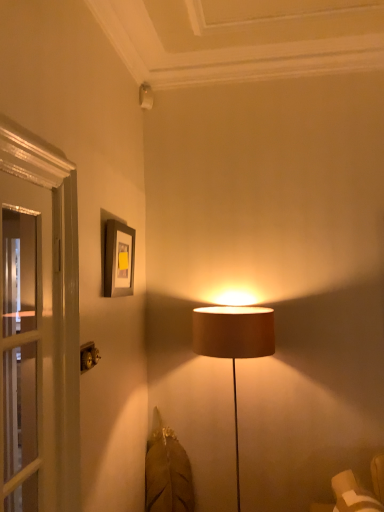
Where is `matte gray picture frame at upper left`? This screenshot has width=384, height=512. matte gray picture frame at upper left is located at coordinates click(x=118, y=259).

Describe the element at coordinates (118, 259) in the screenshot. This screenshot has height=512, width=384. I see `matte gray picture frame at upper left` at that location.

Looking at this image, measure the distance between matte gray picture frame at upper left and camera.

The depth of matte gray picture frame at upper left is 5.60 feet.

What do you see at coordinates (88, 356) in the screenshot? I see `metallic gold at lower left` at bounding box center [88, 356].

Measure the distance between point (85, 356) and camera.

Point (85, 356) and camera are 1.51 meters apart from each other.

Image resolution: width=384 pixels, height=512 pixels. I want to click on metallic gold at lower left, so click(x=88, y=356).

Where is `matte gray picture frame at upper left`? The height and width of the screenshot is (512, 384). matte gray picture frame at upper left is located at coordinates (118, 259).

Considering the positions of objects matte gray picture frame at upper left and metallic gold at lower left in the image provided, who is more to the left, matte gray picture frame at upper left or metallic gold at lower left?

From the viewer's perspective, metallic gold at lower left appears more on the left side.

Does matte gray picture frame at upper left come behind metallic gold at lower left?

Yes, matte gray picture frame at upper left is further from the camera.

Which is farther from the camera, (110, 269) or (90, 351)?

Positioned behind is point (110, 269).

From the image's perspective, who appears lower, matte gray picture frame at upper left or metallic gold at lower left?

metallic gold at lower left.

From a real-world perspective, which object stands above the other?

From a 3D spatial view, matte gray picture frame at upper left is above.

Can you confirm if matte gray picture frame at upper left is wider than metallic gold at lower left?

Indeed, matte gray picture frame at upper left has a greater width compared to metallic gold at lower left.

Is matte gray picture frame at upper left taller than metallic gold at lower left?

Correct, matte gray picture frame at upper left is much taller as metallic gold at lower left.

Who is bigger, matte gray picture frame at upper left or metallic gold at lower left?

Bigger between the two is matte gray picture frame at upper left.

Can we say matte gray picture frame at upper left lies outside metallic gold at lower left?

matte gray picture frame at upper left is positioned outside metallic gold at lower left.

Consider the image. Is the surface of matte gray picture frame at upper left in direct contact with metallic gold at lower left?

No, matte gray picture frame at upper left is not touching metallic gold at lower left.

Does matte gray picture frame at upper left turn towards metallic gold at lower left?

No, matte gray picture frame at upper left is not oriented towards metallic gold at lower left.

This screenshot has height=512, width=384. Identify the location of picture frame that appears behind the metallic gold at lower left. (118, 259).

Which object is positioned more to the left, metallic gold at lower left or matte gray picture frame at upper left?

metallic gold at lower left.

Which is behind, metallic gold at lower left or matte gray picture frame at upper left?

matte gray picture frame at upper left is further away from the camera.

Does point (90, 354) appear closer or farther from the camera than point (122, 252)?

Clearly, point (90, 354) is closer to the camera than point (122, 252).

From the image's perspective, between metallic gold at lower left and matte gray picture frame at upper left, which one is located above?

matte gray picture frame at upper left is shown above in the image.

From a real-world perspective, which object stands above the other?

matte gray picture frame at upper left is physically above.

Considering the relative sizes of metallic gold at lower left and matte gray picture frame at upper left in the image provided, is metallic gold at lower left wider than matte gray picture frame at upper left?

No.

Based on the photo, between metallic gold at lower left and matte gray picture frame at upper left, which one has less height?

metallic gold at lower left is shorter.

Considering the sizes of metallic gold at lower left and matte gray picture frame at upper left in the image, is metallic gold at lower left bigger or smaller than matte gray picture frame at upper left?

metallic gold at lower left is smaller than matte gray picture frame at upper left.

Is matte gray picture frame at upper left inside metallic gold at lower left?

Definitely not — matte gray picture frame at upper left is not inside metallic gold at lower left.

Are metallic gold at lower left and matte gray picture frame at upper left beside each other?

metallic gold at lower left and matte gray picture frame at upper left are not in contact.

Could you tell me if metallic gold at lower left is turned towards matte gray picture frame at upper left?

No, metallic gold at lower left is not facing towards matte gray picture frame at upper left.

How different are the orientations of metallic gold at lower left and matte gray picture frame at upper left in degrees?

The angular difference between metallic gold at lower left and matte gray picture frame at upper left is 0.838 degrees.

Where is `electric outlet below the matte gray picture frame at upper left (from the image's perspective)`? This screenshot has width=384, height=512. electric outlet below the matte gray picture frame at upper left (from the image's perspective) is located at coordinates (88, 356).

In the image, there is a metallic gold at lower left. Identify the location of picture frame above it (from the image's perspective). 118,259.

Locate an element on the screen. The height and width of the screenshot is (512, 384). picture frame on the right of metallic gold at lower left is located at coordinates (118, 259).